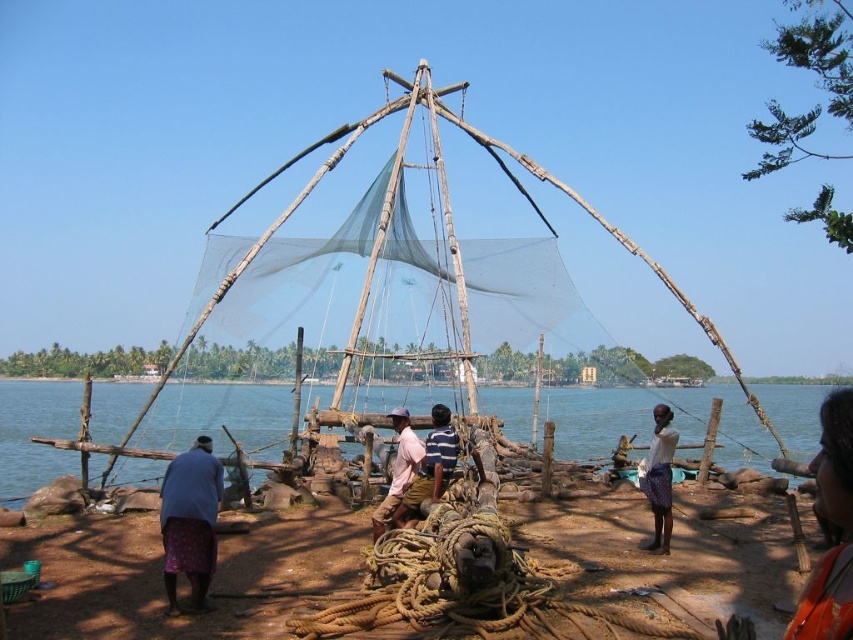
You are a tourist visiting this fishing area and want to take a photo with the orange fabric at lower right and light pink fabric at center in the background. Which fabric should you stand closer to to ensure both are in the frame?

You should stand closer to the orange fabric at lower right because it is bigger than the light pink fabric at center, so it will occupy more space in the photo, ensuring both are visible in the frame.

Consider the image. You are standing at the point marked as point [650,420]. What is the closest object to you?

The closest object to you at point [650,420] is the transparent water at center.